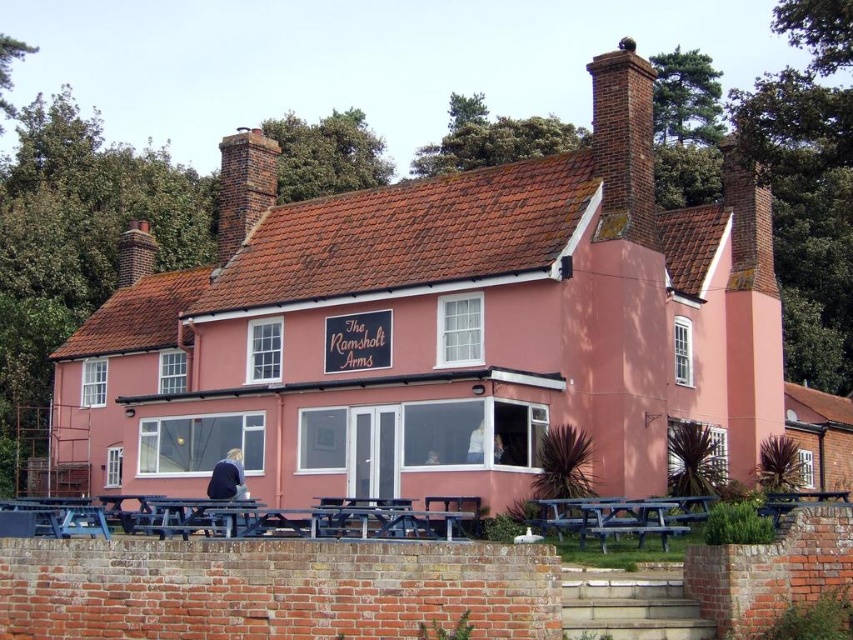
You are standing in front of The Ramsholt Arms and want to take a photo of both the brick chimney at upper center and the brown brick chimney at upper left. Which chimney should you position to your left to include both in the frame?

To include both the brick chimney at upper center and the brown brick chimney at upper left in the frame, position the brown brick chimney at upper left to your left side since it is located to the left of the brick chimney at upper center.

You are planning to install a new flagpole on the roof of The Ramsholt Arms. The flagpole requires a base that must be placed on the larger chimney. Which chimney should you choose between the brick chimney at upper center and the brown brick chimney at upper left?

The brick chimney at upper center is larger in size than the brown brick chimney at upper left, so you should choose the brick chimney at upper center for installing the flagpole base.